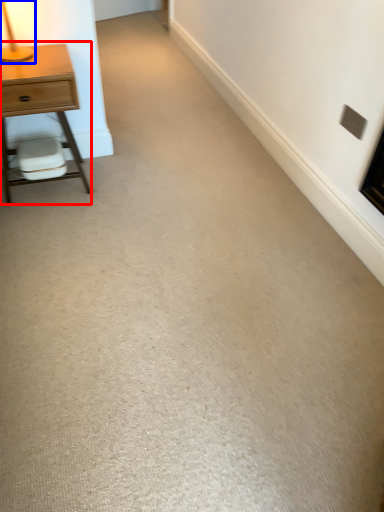
Question: Which of the following is the closest to the observer, nightstand (highlighted by a red box) or table lamp (highlighted by a blue box)?

Choices:
 (A) nightstand
 (B) table lamp

Answer: (B)